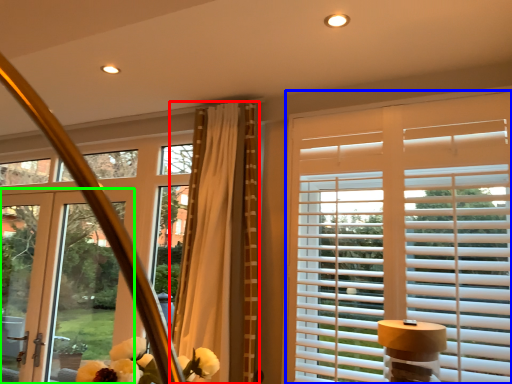
Question: Estimate the real-world distances between objects in this image. Which object is farther from curtain (highlighted by a red box), window blind (highlighted by a blue box) or door (highlighted by a green box)?

Choices:
 (A) window blind
 (B) door

Answer: (B)